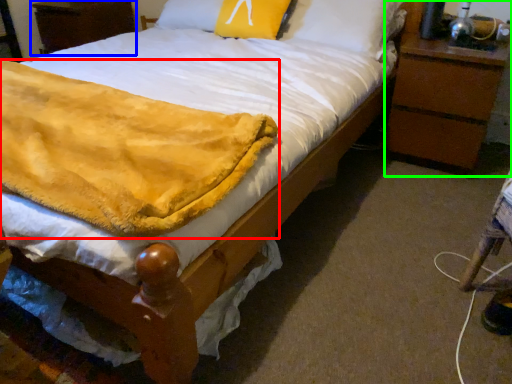
Question: Which is nearer to the blanket (highlighted by a red box)? nightstand (highlighted by a blue box) or nightstand (highlighted by a green box).

Choices:
 (A) nightstand
 (B) nightstand

Answer: (B)